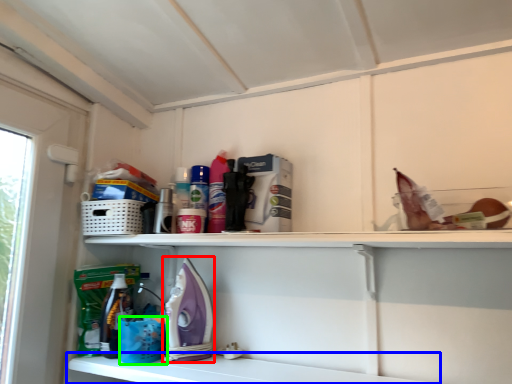
Question: Considering the real-world distances, which object is farthest from appliance (highlighted by a red box)? shelf (highlighted by a blue box) or basket (highlighted by a green box)?

Choices:
 (A) shelf
 (B) basket

Answer: (A)